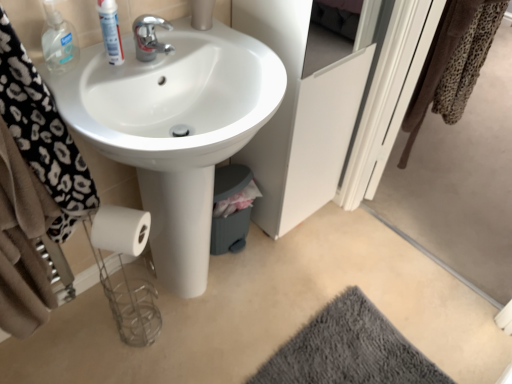
Question: Can you confirm if leopard print towel at upper right is shorter than white glossy sink at center?

Choices:
 (A) yes
 (B) no

Answer: (A)

Question: Considering the relative positions of leopard print towel at upper right and white glossy sink at center in the image provided, is leopard print towel at upper right to the right of white glossy sink at center from the viewer's perspective?

Choices:
 (A) yes
 (B) no

Answer: (A)

Question: From the image's perspective, is leopard print towel at upper right located above white glossy sink at center?

Choices:
 (A) no
 (B) yes

Answer: (B)

Question: From a real-world perspective, is leopard print towel at upper right on white glossy sink at center?

Choices:
 (A) yes
 (B) no

Answer: (A)

Question: Is leopard print towel at upper right closer to camera compared to white glossy sink at center?

Choices:
 (A) no
 (B) yes

Answer: (A)

Question: Considering the positions of gray fuzzy rug at lower right and chrome metallic faucet at upper center in the image, is gray fuzzy rug at lower right wider or thinner than chrome metallic faucet at upper center?

Choices:
 (A) wide
 (B) thin

Answer: (A)

Question: From a real-world perspective, is gray fuzzy rug at lower right above or below chrome metallic faucet at upper center?

Choices:
 (A) below
 (B) above

Answer: (A)

Question: In the image, is gray fuzzy rug at lower right positioned in front of or behind chrome metallic faucet at upper center?

Choices:
 (A) front
 (B) behind

Answer: (B)

Question: Considering the relative positions of gray fuzzy rug at lower right and chrome metallic faucet at upper center in the image provided, is gray fuzzy rug at lower right to the left or to the right of chrome metallic faucet at upper center?

Choices:
 (A) left
 (B) right

Answer: (B)

Question: Is white glossy sink at center situated inside clear plastic bottle at upper left, the 2th mouthwash viewed from the right, or outside?

Choices:
 (A) outside
 (B) inside

Answer: (A)

Question: Is white glossy sink at center in front of or behind clear plastic bottle at upper left, positioned as the first mouthwash in left-to-right order, in the image?

Choices:
 (A) front
 (B) behind

Answer: (A)

Question: In terms of size, does white glossy sink at center appear bigger or smaller than clear plastic bottle at upper left, positioned as the first mouthwash in left-to-right order?

Choices:
 (A) small
 (B) big

Answer: (B)

Question: Based on their positions, is white glossy sink at center located to the left or right of clear plastic bottle at upper left, the 2th mouthwash viewed from the right?

Choices:
 (A) right
 (B) left

Answer: (A)

Question: In terms of size, does black leopard print towel at left appear bigger or smaller than white glossy sink at center?

Choices:
 (A) big
 (B) small

Answer: (B)

Question: Do you think black leopard print towel at left is within white glossy sink at center, or outside of it?

Choices:
 (A) inside
 (B) outside

Answer: (B)